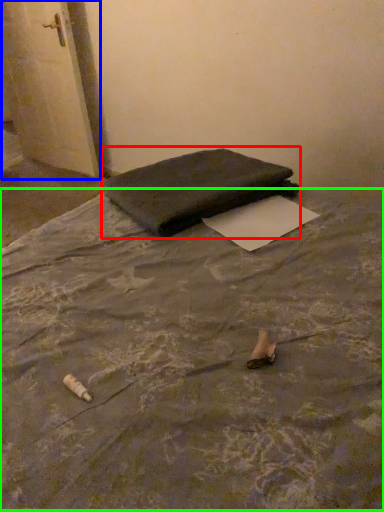
Question: Based on their relative distances, which object is nearer to furniture (highlighted by a red box)? Choose from door (highlighted by a blue box) and mattress (highlighted by a green box).

Choices:
 (A) door
 (B) mattress

Answer: (B)